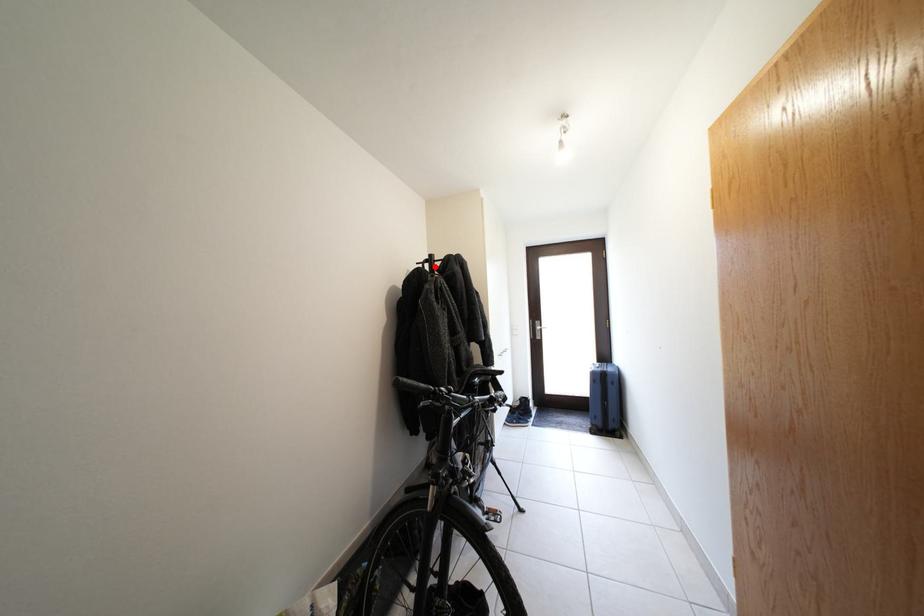
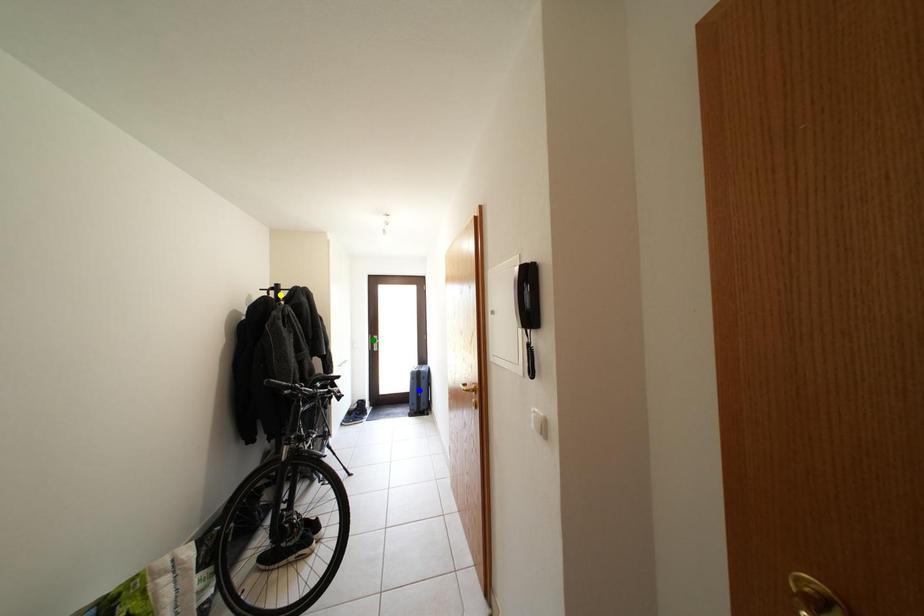
Question: I am providing you with two images of the same scene from different viewpoints. A red point is marked on the first image. You are given multiple points on the second image. Which mark in image 2 goes with the point in image 1?

Choices:
 (A) green point
 (B) yellow point
 (C) blue point

Answer: (B)